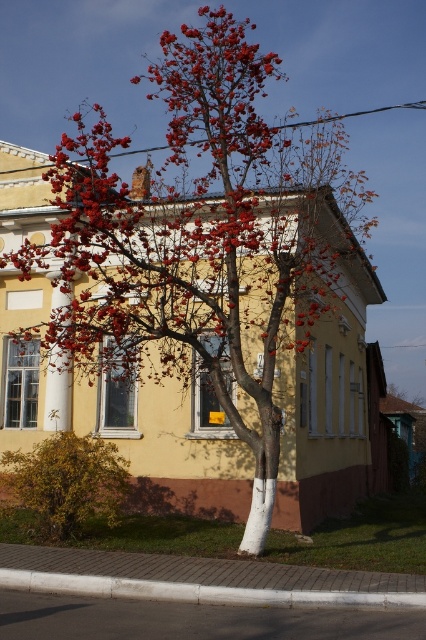
Does golden-brown foliage at center appear on the right side of white concrete curb at lower center?

Incorrect, golden-brown foliage at center is not on the right side of white concrete curb at lower center.

Is golden-brown foliage at center bigger than white concrete curb at lower center?

Indeed, golden-brown foliage at center has a larger size compared to white concrete curb at lower center.

Is point (20, 490) positioned before point (115, 589)?

No, (20, 490) is behind (115, 589).

You are a GUI agent. You are given a task and a screenshot of the screen. Output one action in this format:
    pyautogui.click(x=<x>, y=<y>)
    Task: Click on the golden-brown foliage at center
    Image resolution: width=426 pixels, height=640 pixels.
    Given the screenshot: What is the action you would take?
    pyautogui.click(x=65, y=483)